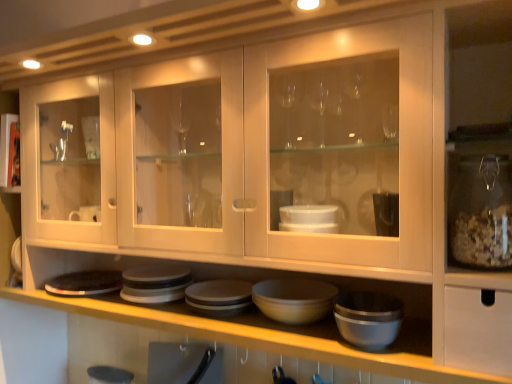
Find the location of a particular element. The image size is (512, 384). matte gray platter at lower center is located at coordinates (85, 283).

What do you see at coordinates (85, 283) in the screenshot?
I see `matte gray platter at lower center` at bounding box center [85, 283].

In the scene shown: What is the approximate height of matte gray bowl at center?

matte gray bowl at center is 2.41 inches in height.

Locate an element on the screen. The width and height of the screenshot is (512, 384). matte gray bowl at center is located at coordinates (294, 299).

Image resolution: width=512 pixels, height=384 pixels. What do you see at coordinates (294, 299) in the screenshot?
I see `matte gray bowl at center` at bounding box center [294, 299].

Identify the location of matte gray platter at lower center. (85, 283).

Which object is positioned more to the right, matte gray platter at lower center or matte gray bowl at center?

Positioned to the right is matte gray bowl at center.

Which is behind, matte gray platter at lower center or matte gray bowl at center?

matte gray platter at lower center is more distant.

Does point (118, 275) appear closer or farther from the camera than point (306, 291)?

Point (118, 275) appears to be farther away from the viewer than point (306, 291).

In the scene shown: From the image's perspective, would you say matte gray platter at lower center is positioned over matte gray bowl at center?

No.

From a real-world perspective, which object stands above the other?

matte gray bowl at center is physically above.

Which object is wider, matte gray platter at lower center or matte gray bowl at center?

Wider between the two is matte gray platter at lower center.

Considering the relative sizes of matte gray platter at lower center and matte gray bowl at center in the image provided, is matte gray platter at lower center shorter than matte gray bowl at center?

Correct, matte gray platter at lower center is not as tall as matte gray bowl at center.

Is matte gray platter at lower center bigger than matte gray bowl at center?

No, matte gray platter at lower center is not bigger than matte gray bowl at center.

Is matte gray platter at lower center completely or partially outside of matte gray bowl at center?

Indeed, matte gray platter at lower center is completely outside matte gray bowl at center.

Is matte gray platter at lower center not near matte gray bowl at center?

No, there isn't a large distance between matte gray platter at lower center and matte gray bowl at center.

Could you tell me if matte gray platter at lower center is turned towards matte gray bowl at center?

No, matte gray platter at lower center is not oriented towards matte gray bowl at center.

What's the angular difference between matte gray platter at lower center and matte gray bowl at center's facing directions?

They differ by 5.6e-05 degrees in their facing directions.

At what (x,y) coordinates should I click in order to perform the action: click on basin above the matte gray platter at lower center (from the image's perspective). Please return your answer as a coordinate pair (x, y). Looking at the image, I should click on (294, 299).

Between matte gray bowl at center and matte gray platter at lower center, which one appears on the left side from the viewer's perspective?

matte gray platter at lower center is more to the left.

Considering their positions, is matte gray bowl at center located in front of or behind matte gray platter at lower center?

matte gray bowl at center is positioned closer to the viewer than matte gray platter at lower center.

Is point (276, 287) farther from camera compared to point (87, 274)?

No, (276, 287) is closer to viewer.

From the image's perspective, is matte gray bowl at center located beneath matte gray platter at lower center?

Actually, matte gray bowl at center appears above matte gray platter at lower center in the image.

From a real-world perspective, who is located higher, matte gray bowl at center or matte gray platter at lower center?

From a 3D spatial view, matte gray bowl at center is above.

Does matte gray bowl at center have a lesser width compared to matte gray platter at lower center?

Yes, matte gray bowl at center is thinner than matte gray platter at lower center.

From their relative heights in the image, would you say matte gray bowl at center is taller or shorter than matte gray platter at lower center?

Clearly, matte gray bowl at center is taller compared to matte gray platter at lower center.

Can you confirm if matte gray bowl at center is bigger than matte gray platter at lower center?

Yes, matte gray bowl at center is bigger than matte gray platter at lower center.

Consider the image. Is matte gray bowl at center inside the boundaries of matte gray platter at lower center, or outside?

matte gray bowl at center is outside matte gray platter at lower center.

Is matte gray bowl at center positioned far away from matte gray platter at lower center?

That's not correct — matte gray bowl at center is a little close to matte gray platter at lower center.

Is matte gray bowl at center looking in the opposite direction of matte gray platter at lower center?

matte gray bowl at center does not have its back to matte gray platter at lower center.

Image resolution: width=512 pixels, height=384 pixels. I want to click on basin above the matte gray platter at lower center (from a real-world perspective), so pos(294,299).

The image size is (512, 384). In order to click on basin in front of the matte gray platter at lower center in this screenshot , I will do `click(294, 299)`.

Find the location of a particular element. Image resolution: width=512 pixels, height=384 pixels. platter behind the matte gray bowl at center is located at coordinates (85, 283).